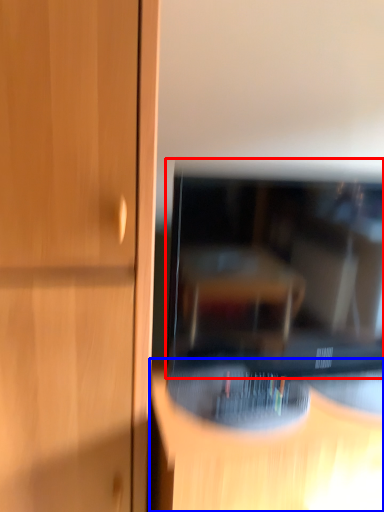
Question: Which object appears closest to the camera in this image, television (highlighted by a red box) or furniture (highlighted by a blue box)?

Choices:
 (A) television
 (B) furniture

Answer: (B)